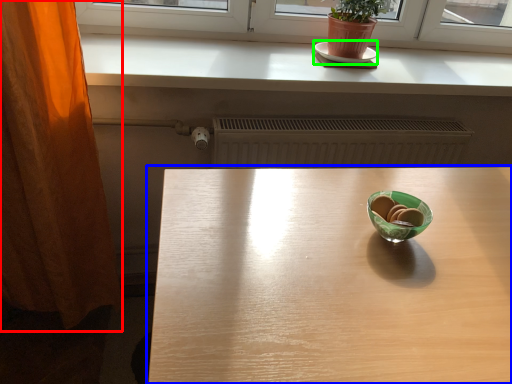
Question: Which object is the farthest from curtain (highlighted by a red box)? Choose among these: table (highlighted by a blue box) or plate (highlighted by a green box).

Choices:
 (A) table
 (B) plate

Answer: (B)